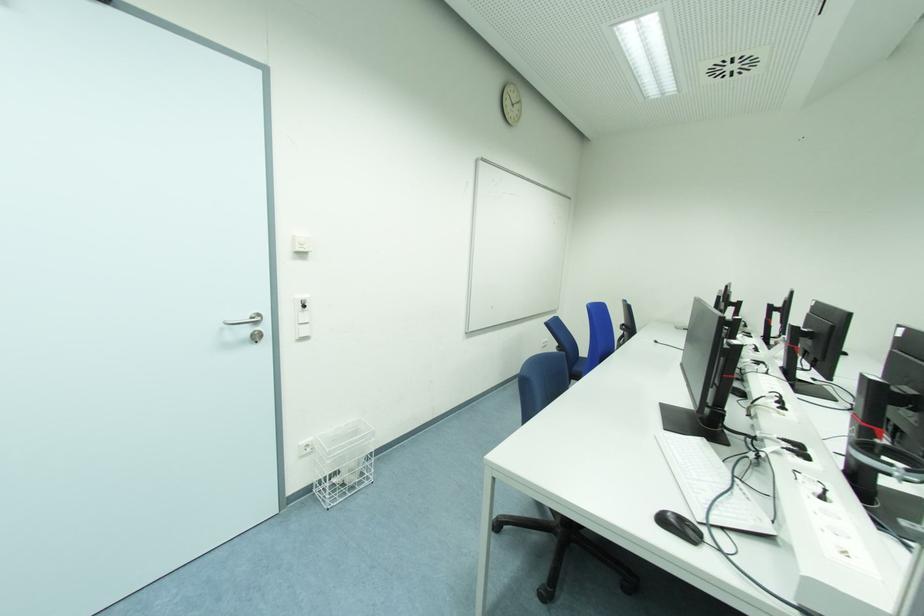
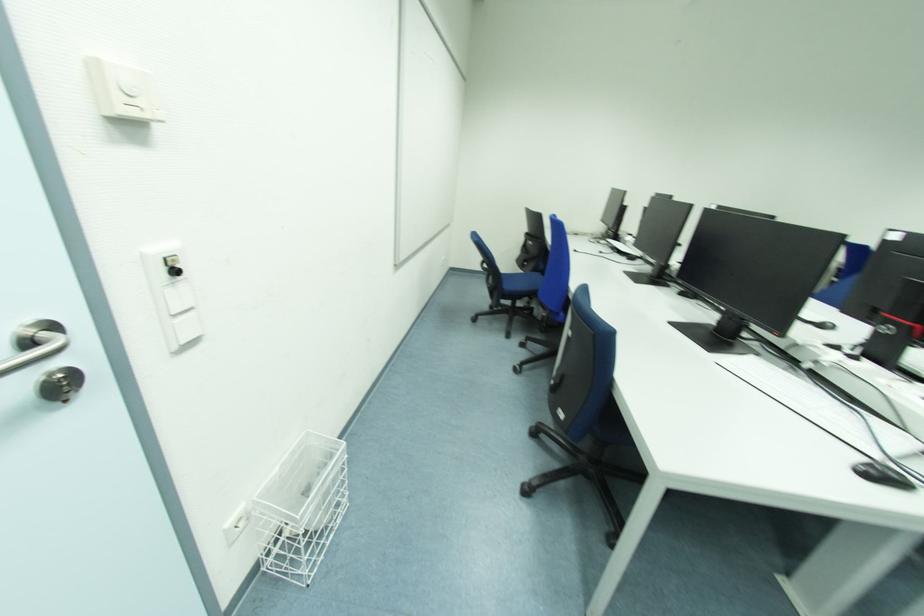
In the second image, find the point that corresponds to [314,487] in the first image.

(261, 564)